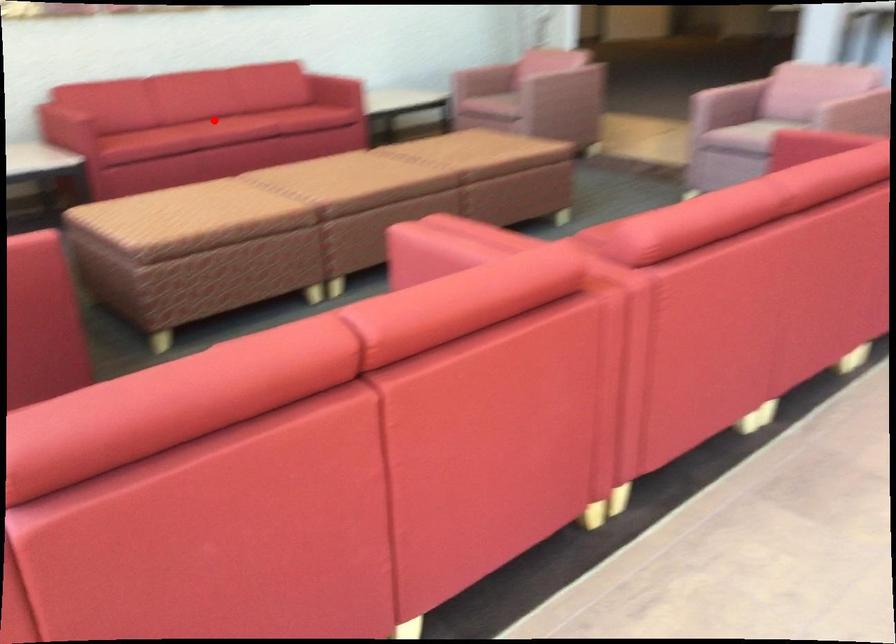
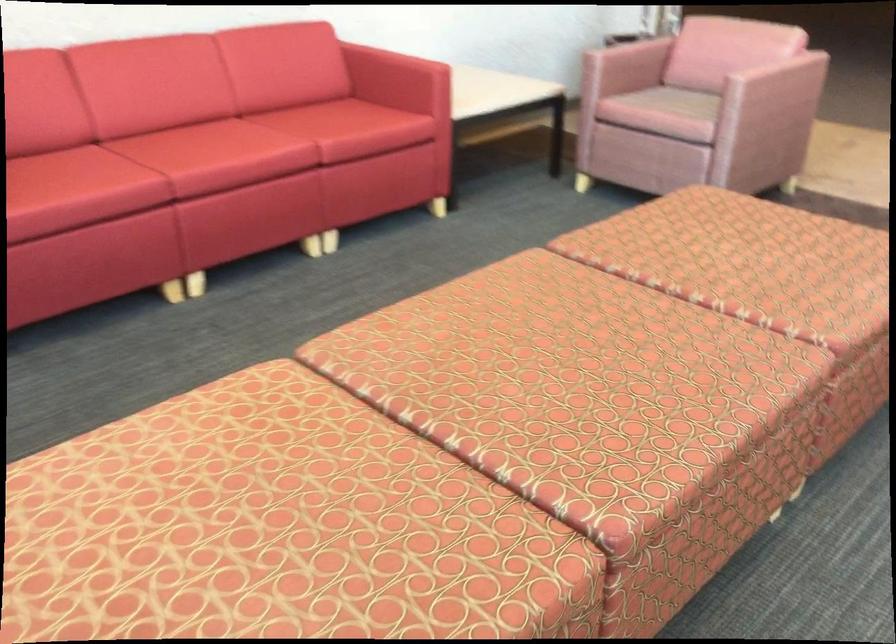
Question: A red point is marked in image1. In image2, is the corresponding 3D point closer to the camera or farther? Reply with the corresponding letter.

Choices:
 (A) The corresponding 3D point is closer.
 (B) The corresponding 3D point is farther.

Answer: (A)